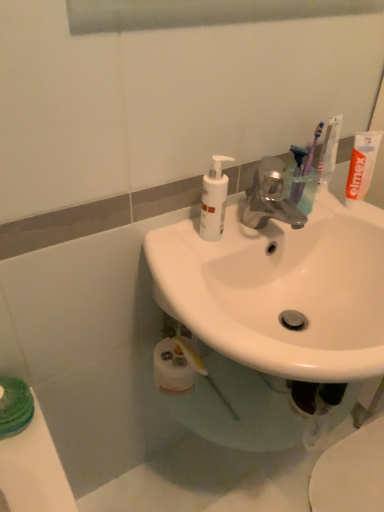
Locate an element on the screen. free space to the left of white glossy toilet at lower right is located at coordinates (253, 473).